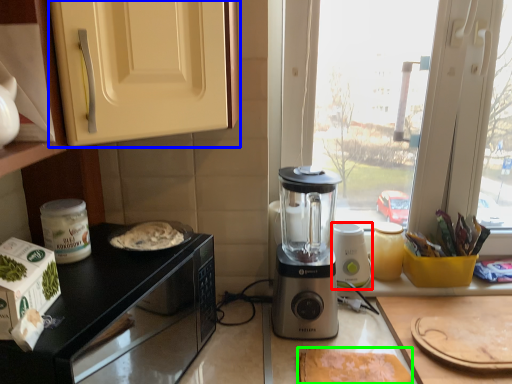
Question: Based on their relative distances, which object is nearer to blender (highlighted by a red box)? Choose from cabinetry (highlighted by a blue box) and food (highlighted by a green box).

Choices:
 (A) cabinetry
 (B) food

Answer: (B)